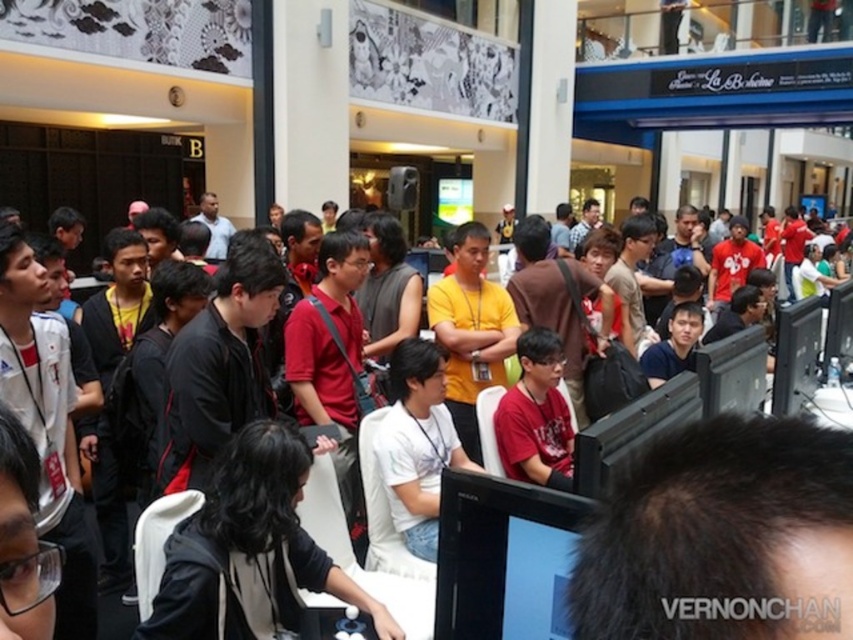
Does black fabric jacket at center have a greater width compared to red matte shirt at center?

Indeed, black fabric jacket at center has a greater width compared to red matte shirt at center.

Can you confirm if black fabric jacket at center is positioned below red matte shirt at center?

Yes.

Does point (288, 452) come in front of point (541, 381)?

Yes, it is in front of point (541, 381).

The height and width of the screenshot is (640, 853). I want to click on black fabric jacket at center, so click(x=250, y=550).

Between black fabric jacket at center and black glossy monitor at center, which one is positioned lower?

black fabric jacket at center is lower down.

Can you confirm if black fabric jacket at center is thinner than black glossy monitor at center?

In fact, black fabric jacket at center might be wider than black glossy monitor at center.

Which is in front, point (172, 557) or point (566, 573)?

Positioned in front is point (566, 573).

Identify the location of black fabric jacket at center. (250, 550).

Which is more to the right, black glossy monitor at center or red matte shirt at center?

Positioned to the right is red matte shirt at center.

Is black glossy monitor at center closer to the viewer compared to red matte shirt at center?

That is True.

What do you see at coordinates (503, 557) in the screenshot? The width and height of the screenshot is (853, 640). I see `black glossy monitor at center` at bounding box center [503, 557].

I want to click on black glossy monitor at center, so click(x=503, y=557).